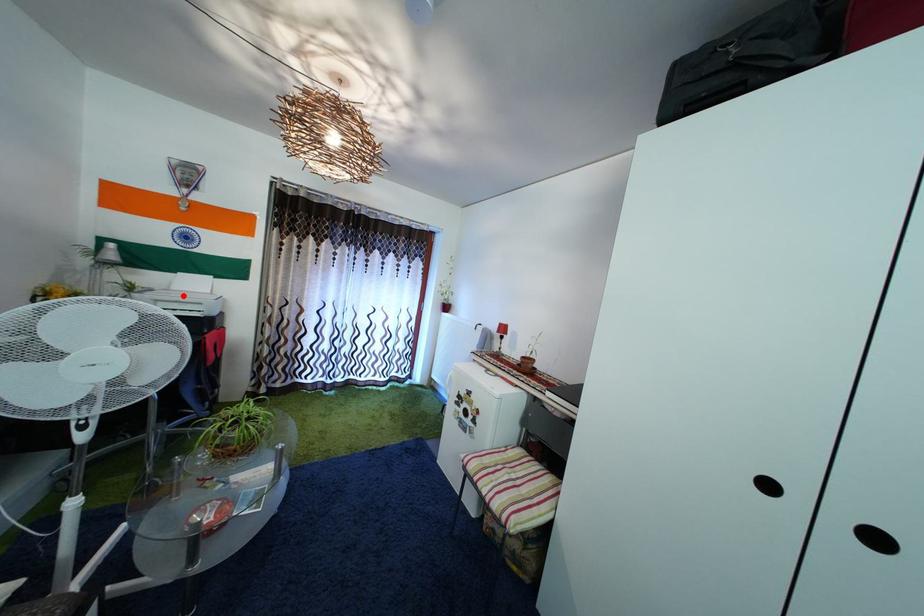
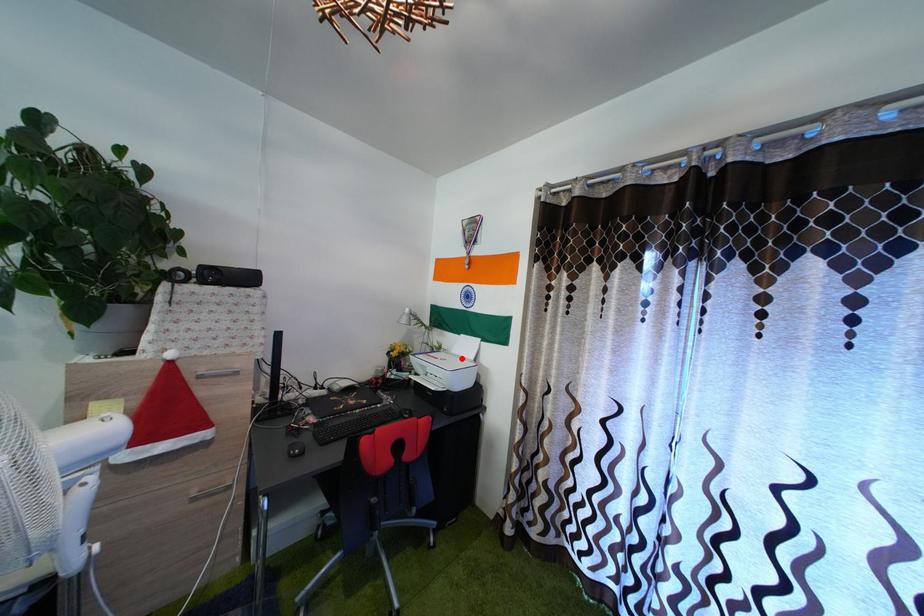
I am providing you with two images of the same scene from different viewpoints. A red point is marked on the first image and another point is marked on the second image. Is the marked point in image1 the same physical position as the marked point in image2?

Yes